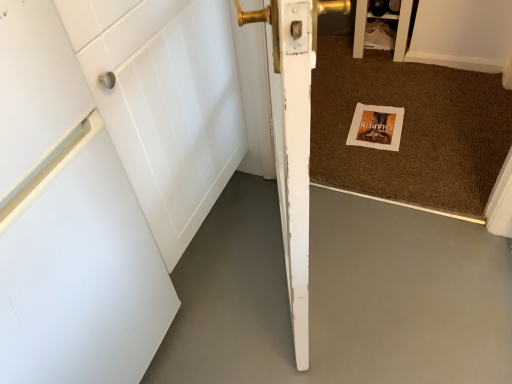
At what (x,y) coordinates should I click in order to perform the action: click on free spot to the left of white matte door at center. Please return your answer as a coordinate pair (x, y). The height and width of the screenshot is (384, 512). Looking at the image, I should click on (224, 280).